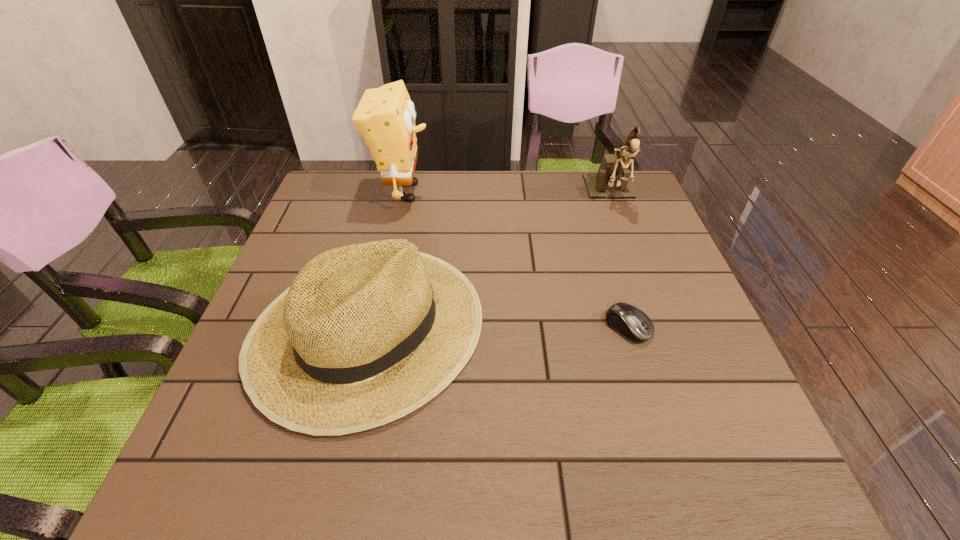
You are a GUI agent. You are given a task and a screenshot of the screen. Output one action in this format:
    pyautogui.click(x=<x>, y=<y>)
    Task: Click on the sponge
    Image resolution: width=960 pixels, height=540 pixels.
    Given the screenshot: What is the action you would take?
    pyautogui.click(x=385, y=117)

The width and height of the screenshot is (960, 540). Find the location of `figurine`. figurine is located at coordinates (612, 180).

Identify the location of the third tallest object. The width and height of the screenshot is (960, 540). (367, 333).

Where is `mouse`? mouse is located at coordinates (631, 322).

This screenshot has height=540, width=960. In order to click on vacant region located 0.390m on the face of the sponge in this screenshot , I will do `click(564, 192)`.

This screenshot has height=540, width=960. Identify the location of blank space located 0.400m on the front-facing side of the figurine. (662, 328).

Identify the location of vacant point located 0.080m on the right of the second shortest object. The image size is (960, 540). (520, 326).

This screenshot has height=540, width=960. Find the location of `free space located on the back of the shortest object`. free space located on the back of the shortest object is located at coordinates (593, 213).

Locate an element on the screen. sponge that is at the far edge is located at coordinates (385, 117).

Where is `figurine situated at the far edge`? This screenshot has width=960, height=540. figurine situated at the far edge is located at coordinates (612, 180).